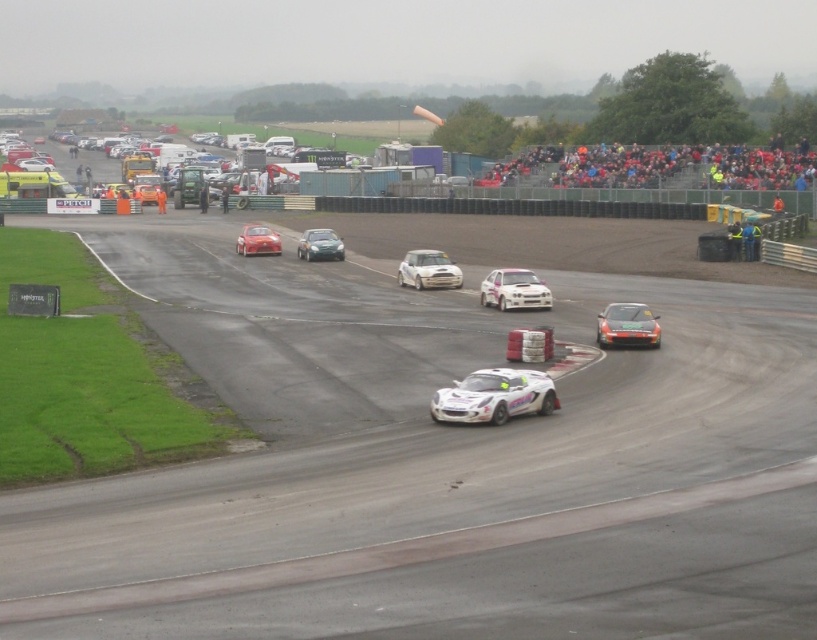
Question: Can you confirm if smooth asphalt race track at center is positioned to the right of shiny silver car at center?

Choices:
 (A) yes
 (B) no

Answer: (A)

Question: Is shiny red car at lower right to the left of shiny red car at center from the viewer's perspective?

Choices:
 (A) no
 (B) yes

Answer: (A)

Question: Which of these objects is positioned farthest from the shiny red car at lower right?

Choices:
 (A) smooth asphalt race track at center
 (B) shiny silver car at center

Answer: (B)

Question: Which object is the farthest from the shiny red car at center?

Choices:
 (A) white matte car at center
 (B) shiny silver car at center
 (C) white glossy race car at center
 (D) shiny red car at lower right

Answer: (C)

Question: Does white matte rally car at center have a lesser width compared to shiny silver car at center?

Choices:
 (A) no
 (B) yes

Answer: (B)

Question: Which of the following is the closest to the observer?

Choices:
 (A) (643, 337)
 (B) (444, 282)
 (C) (543, 285)
 (D) (268, 248)

Answer: (A)